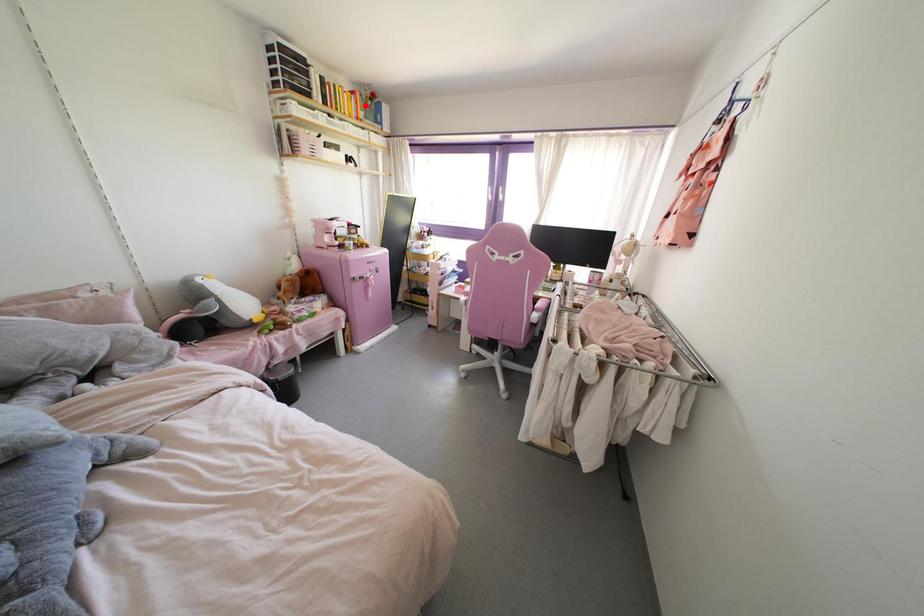
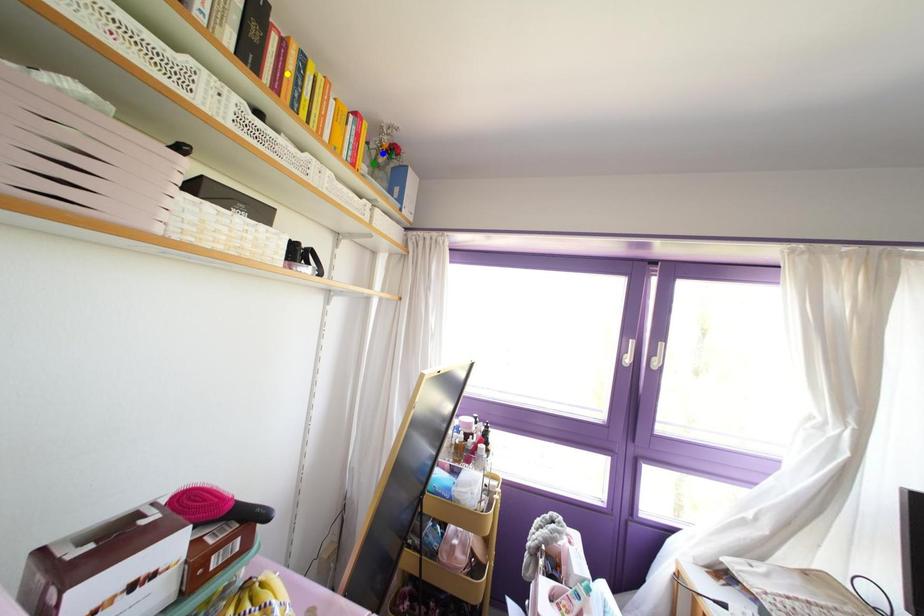
Question: I am providing you with two images of the same scene from different viewpoints. A red point is marked on the first image. You are given multiple points on the second image. Which point in image 2 represents the same 3d spot as the red point in image 1?

Choices:
 (A) green point
 (B) yellow point
 (C) blue point

Answer: (A)